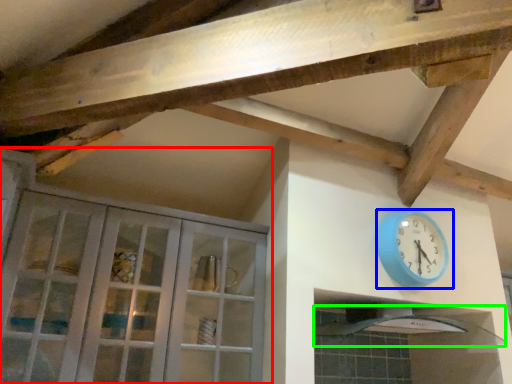
Question: Which object is the farthest from cabinetry (highlighted by a red box)? Choose among these: wall clock (highlighted by a blue box) or exhaust hood (highlighted by a green box).

Choices:
 (A) wall clock
 (B) exhaust hood

Answer: (B)